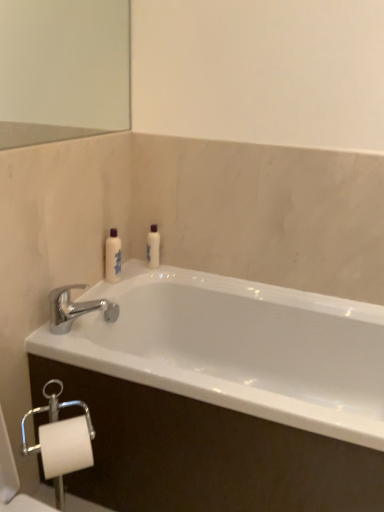
Question: In which direction should I rotate to look at white glossy lotion at center, the 2th toiletry from the front?

Choices:
 (A) right
 (B) left

Answer: (B)

Question: Can we say white glossy bottle at upper left, the second toiletry when ordered from back to front, lies outside white glossy bathtub at center?

Choices:
 (A) yes
 (B) no

Answer: (A)

Question: Is white glossy bathtub at center at the back of white glossy bottle at upper left, placed as the 2th toiletry when sorted from right to left?

Choices:
 (A) yes
 (B) no

Answer: (B)

Question: Can you confirm if white glossy bottle at upper left, which ranks as the 1th toiletry in left-to-right order, is smaller than white glossy bathtub at center?

Choices:
 (A) no
 (B) yes

Answer: (B)

Question: Is white glossy bathtub at center surrounded by white glossy bottle at upper left, which ranks as the 1th toiletry in left-to-right order?

Choices:
 (A) yes
 (B) no

Answer: (B)

Question: From the image's perspective, is white glossy bottle at upper left, which is counted as the first toiletry, starting from the front, below white glossy bathtub at center?

Choices:
 (A) no
 (B) yes

Answer: (A)

Question: Could you tell me if white glossy bottle at upper left, which is counted as the first toiletry, starting from the front, is turned towards white glossy bathtub at center?

Choices:
 (A) yes
 (B) no

Answer: (B)

Question: Considering the relative sizes of white glossy bottle at upper left, the second toiletry when ordered from back to front, and white glossy lotion at center, the first toiletry positioned from the back, in the image provided, is white glossy bottle at upper left, the second toiletry when ordered from back to front, bigger than white glossy lotion at center, the first toiletry positioned from the back,?

Choices:
 (A) yes
 (B) no

Answer: (A)

Question: Is white glossy bottle at upper left, which is counted as the first toiletry, starting from the front, located outside white glossy lotion at center, the 2th toiletry from the front?

Choices:
 (A) yes
 (B) no

Answer: (A)

Question: Is white glossy bottle at upper left, which ranks as the 1th toiletry in left-to-right order, far away from white glossy lotion at center, the 1th toiletry viewed from the right?

Choices:
 (A) no
 (B) yes

Answer: (A)

Question: Is white glossy lotion at center, the 1th toiletry viewed from the right, surrounded by white glossy bottle at upper left, placed as the 2th toiletry when sorted from right to left?

Choices:
 (A) no
 (B) yes

Answer: (A)

Question: Is white glossy bottle at upper left, placed as the 2th toiletry when sorted from right to left, touching white glossy lotion at center, the 1th toiletry viewed from the right?

Choices:
 (A) no
 (B) yes

Answer: (A)

Question: Does white glossy bottle at upper left, which ranks as the 1th toiletry in left-to-right order, have a greater width compared to white glossy lotion at center, the first toiletry positioned from the back?

Choices:
 (A) no
 (B) yes

Answer: (B)

Question: Is white glossy lotion at center, positioned as the 2th toiletry in left-to-right order, positioned before white glossy bottle at upper left, which ranks as the 1th toiletry in left-to-right order?

Choices:
 (A) no
 (B) yes

Answer: (A)